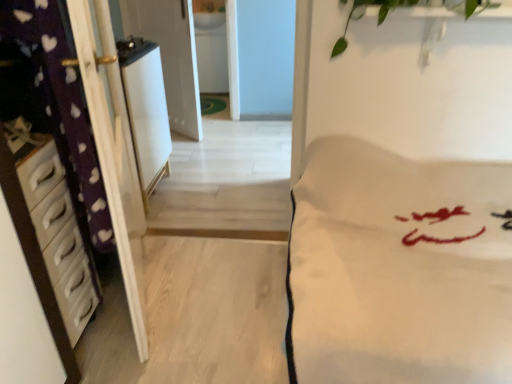
Question: Does point (194, 86) appear closer or farther from the camera than point (204, 11)?

Choices:
 (A) closer
 (B) farther

Answer: (A)

Question: Would you say white glossy screen door at upper center is to the left or to the right of white glossy sink at upper center in the picture?

Choices:
 (A) left
 (B) right

Answer: (A)

Question: Considering the real-world distances, which object is closest to the white plastic chest of drawers at left?

Choices:
 (A) white glossy refrigerator at center
 (B) white glossy sink at upper center
 (C) white glossy screen door at upper center
 (D) green leafy plant at upper center
 (E) white soft fabric at center

Answer: (A)

Question: Which object is positioned farthest from the white glossy screen door at upper center?

Choices:
 (A) white glossy sink at upper center
 (B) green leafy plant at upper center
 (C) white soft fabric at center
 (D) white plastic chest of drawers at left
 (E) white glossy refrigerator at center

Answer: (C)